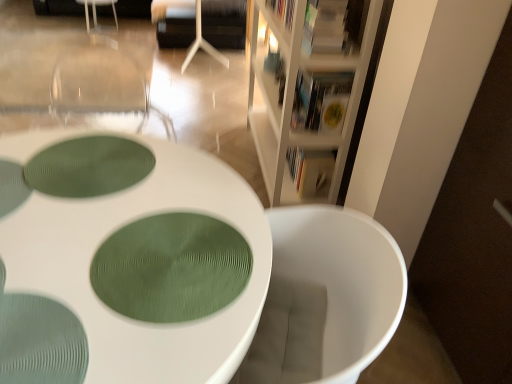
Find the location of a particular element. This screenshot has height=384, width=512. free point in front of green textured oval at center, marked as the 1th oval in a front-to-back arrangement is located at coordinates (123, 349).